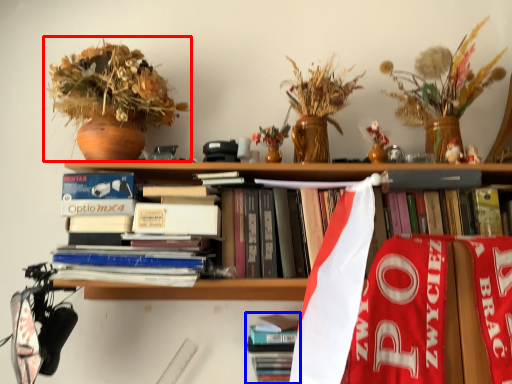
Question: Which object is closer to the camera taking this photo, houseplant (highlighted by a red box) or book (highlighted by a blue box)?

Choices:
 (A) houseplant
 (B) book

Answer: (A)